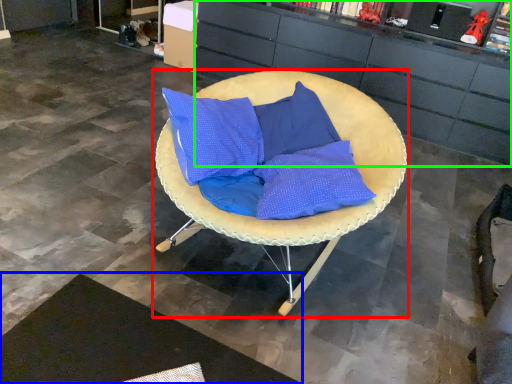
Question: Based on their relative distances, which object is farther from chair (highlighted by a red box)? Choose from mat (highlighted by a blue box) and cabinetry (highlighted by a green box).

Choices:
 (A) mat
 (B) cabinetry

Answer: (B)